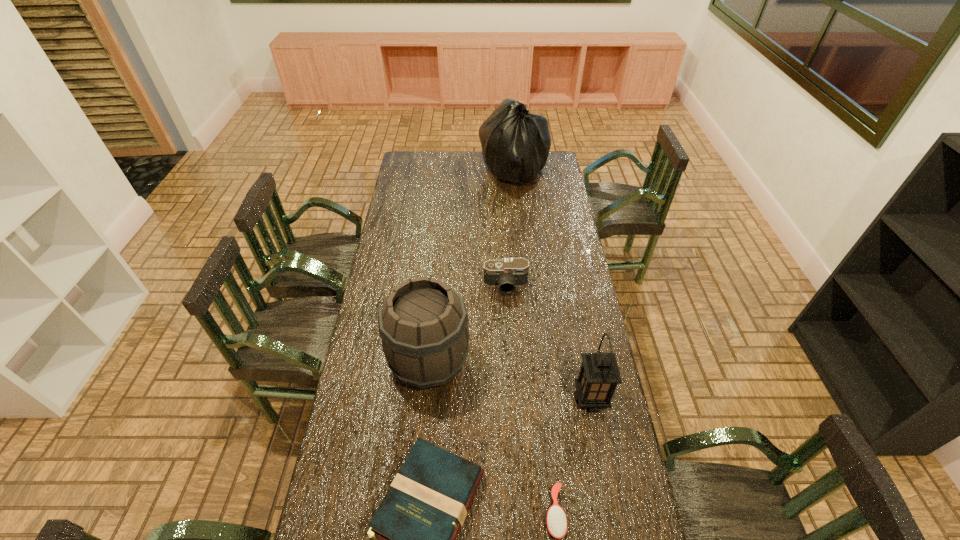
Image resolution: width=960 pixels, height=540 pixels. Identify the location of free space between the lantern and the wine bucket. (510, 381).

Find the location of a particular element. The width and height of the screenshot is (960, 540). unoccupied area between the wine bucket and the tallest object is located at coordinates tap(471, 266).

Choose which object is the fourth nearest neighbor to the hardback book. Please provide its 2D coordinates. Your answer should be formatted as a tuple, i.e. [(x, y)], where the tuple contains the x and y coordinates of a point satisfying the conditions above.

[(508, 273)]

The image size is (960, 540). I want to click on the fourth closest object relative to the lantern, so click(x=508, y=273).

Locate an element on the screen. The width and height of the screenshot is (960, 540). free space that satisfies the following two spatial constraints: 1. on the front-facing side of the lantern; 2. on the right side of the third shortest object is located at coordinates (512, 399).